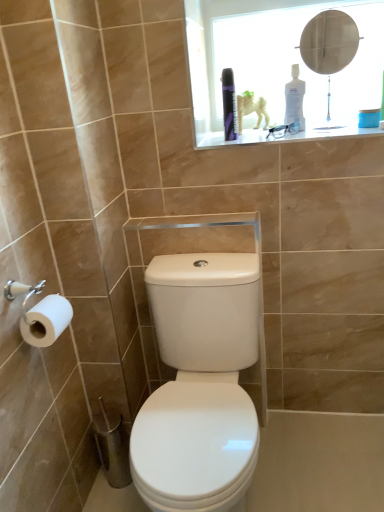
Where is `vacant space behind purple glossy can at upper center, which appears as the 2th toiletry when viewed from the right`? The width and height of the screenshot is (384, 512). vacant space behind purple glossy can at upper center, which appears as the 2th toiletry when viewed from the right is located at coordinates (248, 131).